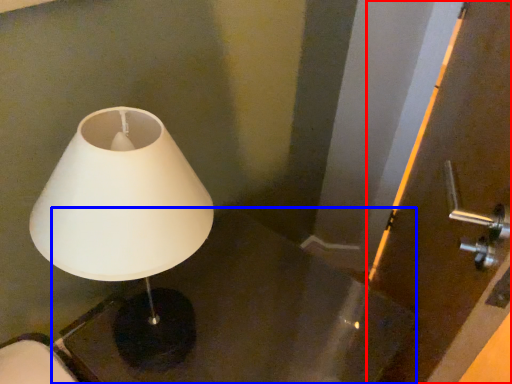
Question: Among these objects, which one is farthest to the camera, screen door (highlighted by a red box) or table (highlighted by a blue box)?

Choices:
 (A) screen door
 (B) table

Answer: (B)